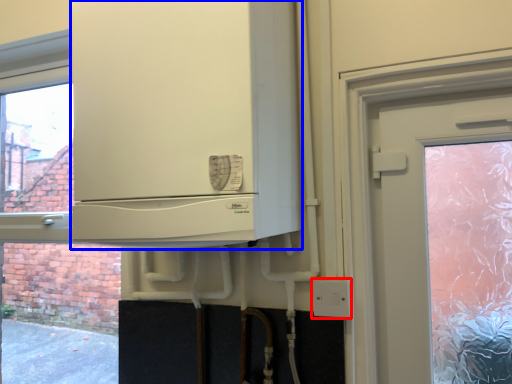
Question: Which point is closer to the camera, electric outlet (highlighted by a red box) or cabinetry (highlighted by a blue box)?

Choices:
 (A) electric outlet
 (B) cabinetry

Answer: (B)